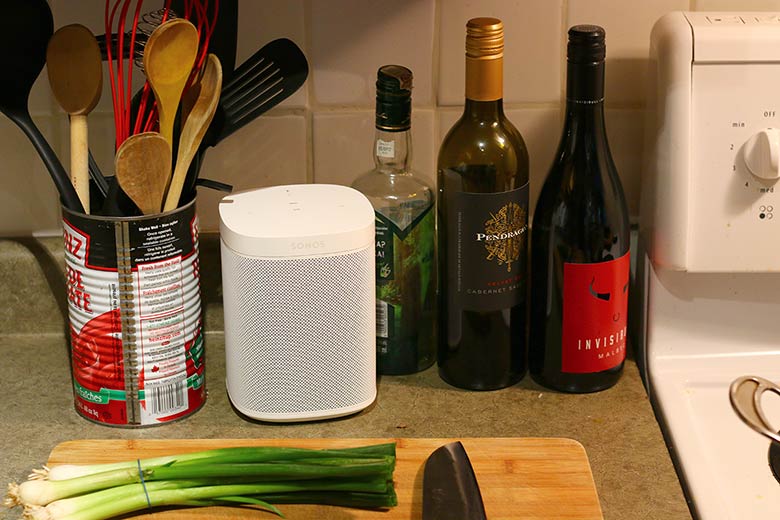
I want to click on countertop, so click(x=604, y=431).